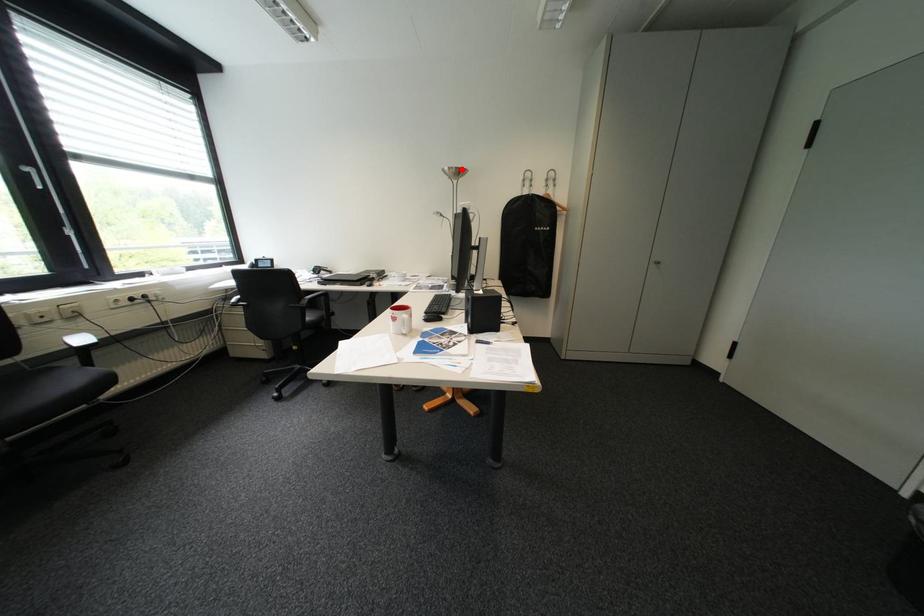
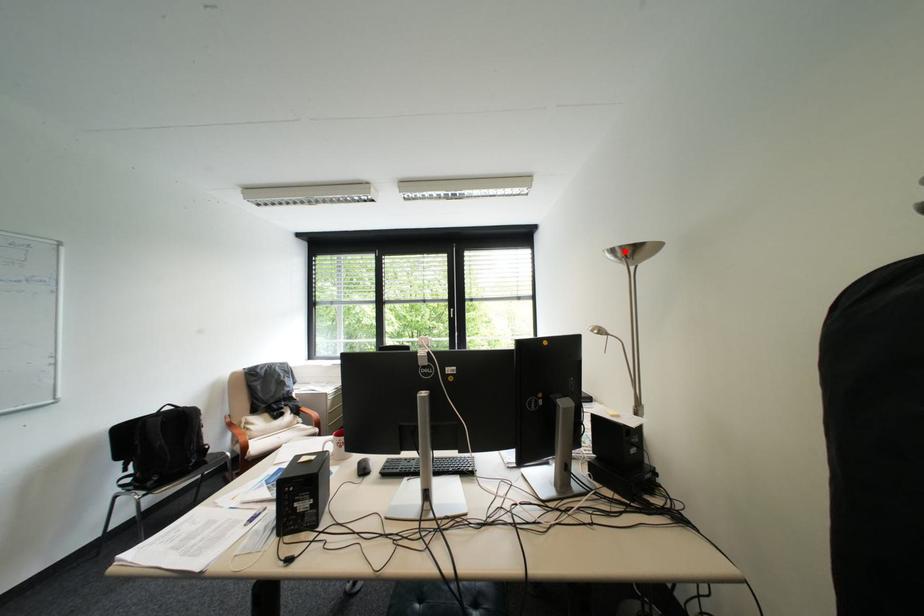
I am providing you with two images of the same scene from different viewpoints. A red point is marked on the first image and another point is marked on the second image. Are the points marked in image1 and image2 representing the same 3D position?

Yes